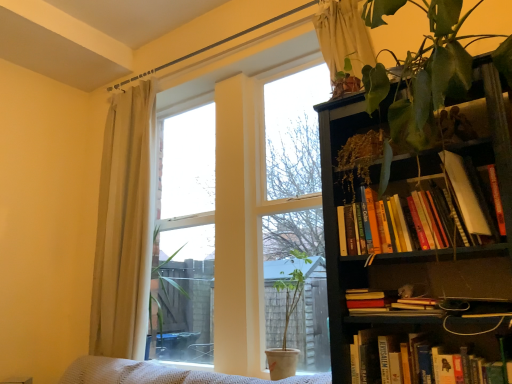
Question: Is white sheer curtain at upper center, which ranks as the first curtain in front-to-back order, outside hardcover book at lower right, which is the 2th book from top to bottom?

Choices:
 (A) no
 (B) yes

Answer: (B)

Question: Would you say white sheer curtain at upper center, which is the 1th curtain from right to left, is a long distance from hardcover book at lower right, arranged as the first book when ordered from the bottom?

Choices:
 (A) no
 (B) yes

Answer: (B)

Question: Does white sheer curtain at upper center, the 2th curtain when ordered from back to front, appear on the left side of hardcover book at lower right, which is the 2th book from top to bottom?

Choices:
 (A) no
 (B) yes

Answer: (B)

Question: From a real-world perspective, is white sheer curtain at upper center, the 2th curtain when ordered from back to front, below hardcover book at lower right, arranged as the first book when ordered from the bottom?

Choices:
 (A) no
 (B) yes

Answer: (A)

Question: From the image's perspective, is white sheer curtain at upper center, which is the 1th curtain from right to left, on top of hardcover book at lower right, which is the 2th book from top to bottom?

Choices:
 (A) no
 (B) yes

Answer: (B)

Question: Is white sheer curtain at upper center, which ranks as the first curtain in front-to-back order, closer to camera compared to hardcover book at lower right, which is the 2th book from top to bottom?

Choices:
 (A) yes
 (B) no

Answer: (B)

Question: Considering the relative sizes of matte white pot at center and green leafy plant at upper right in the image provided, is matte white pot at center thinner than green leafy plant at upper right?

Choices:
 (A) no
 (B) yes

Answer: (B)

Question: Is matte white pot at center taller than green leafy plant at upper right?

Choices:
 (A) yes
 (B) no

Answer: (B)

Question: From the image's perspective, is matte white pot at center on green leafy plant at upper right?

Choices:
 (A) no
 (B) yes

Answer: (A)

Question: Is matte white pot at center located outside green leafy plant at upper right?

Choices:
 (A) yes
 (B) no

Answer: (A)

Question: From the image's perspective, is matte white pot at center beneath green leafy plant at upper right?

Choices:
 (A) yes
 (B) no

Answer: (A)

Question: From a real-world perspective, is matte white pot at center located beneath green leafy plant at upper right?

Choices:
 (A) no
 (B) yes

Answer: (B)

Question: Is transparent glass window at center behind white sheer curtain at upper center, which is the 1th curtain from right to left?

Choices:
 (A) no
 (B) yes

Answer: (A)